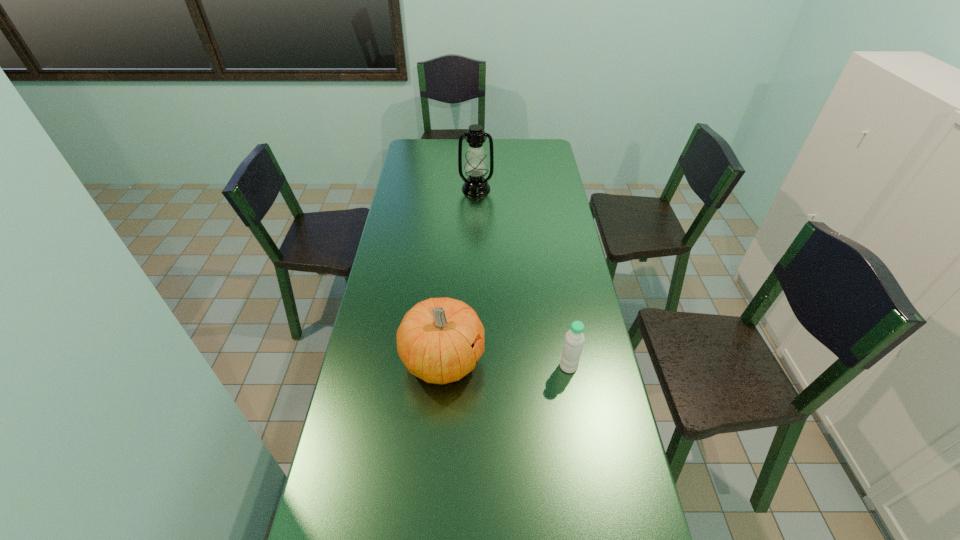
In the image, there is a desktop. Where is `vacant region at the left edge`? vacant region at the left edge is located at coordinates (408, 231).

Find the location of a particular element. The height and width of the screenshot is (540, 960). vacant area at the right edge of the desktop is located at coordinates (540, 178).

Find the location of a particular element. vacant space at the far left corner is located at coordinates (424, 149).

This screenshot has height=540, width=960. I want to click on empty space between the rightmost object and the farthest object, so click(x=522, y=278).

Find the location of `free point between the oil lamp and the second shortest object`. free point between the oil lamp and the second shortest object is located at coordinates (460, 275).

Where is `object that is the second nearest to the pumpkin`? object that is the second nearest to the pumpkin is located at coordinates click(x=475, y=166).

Locate an element on the screen. The height and width of the screenshot is (540, 960). object identified as the closest to the pumpkin is located at coordinates (574, 338).

This screenshot has width=960, height=540. I want to click on free space that satisfies the following two spatial constraints: 1. on the front-facing side of the shortest object; 2. on the left side of the pumpkin, so click(x=443, y=367).

Find the location of `free space that satisfies the following two spatial constraints: 1. on the front-facing side of the shortest object; 2. on the right side of the second shortest object`. free space that satisfies the following two spatial constraints: 1. on the front-facing side of the shortest object; 2. on the right side of the second shortest object is located at coordinates (443, 367).

This screenshot has height=540, width=960. I want to click on vacant space that satisfies the following two spatial constraints: 1. on the front side of the shortest object; 2. on the left side of the oil lamp, so click(x=474, y=367).